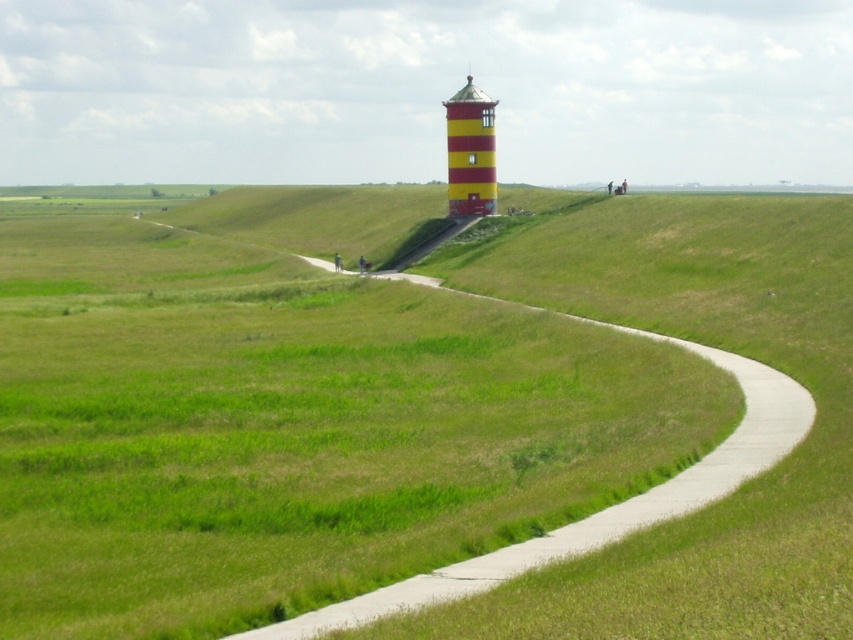
Who is more forward, (670, 572) or (489, 211)?

Positioned in front is point (670, 572).

Is green grass at upper center positioned at the back of yellow striped tower at center?

That is False.

Find the location of a particular element. green grass at upper center is located at coordinates (289, 413).

Image resolution: width=853 pixels, height=640 pixels. What are the coordinates of `green grass at upper center` in the screenshot? It's located at (289, 413).